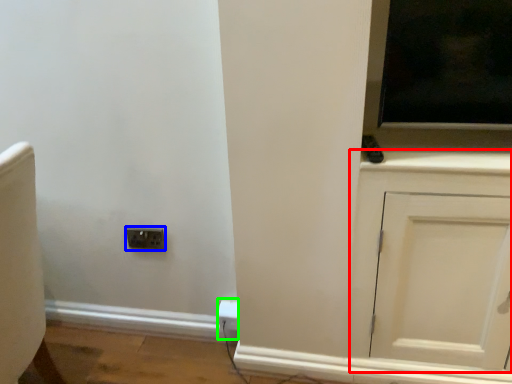
Question: Which object is positioned farthest from cabinetry (highlighted by a red box)? Select from socket (highlighted by a blue box) and electric outlet (highlighted by a green box).

Choices:
 (A) socket
 (B) electric outlet

Answer: (A)